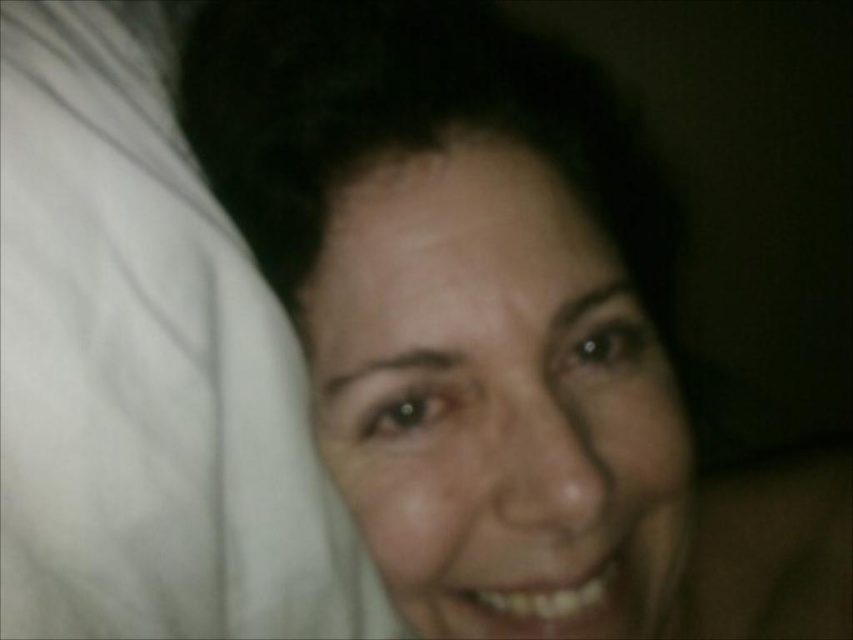
You are a photographer adjusting lighting for a portrait. You notice the white soft fabric at left and the smooth skin face at center in the frame. Which object is positioned higher in the image?

The white soft fabric at left is above the smooth skin face at center, so it is positioned higher in the image.

Looking at this image, you are a photographer trying to adjust the lighting for a portrait. You notice the smooth skin face at center and the white soft fabric at left in the frame. Which object is closer to the camera?

The white soft fabric at left is closer to the camera because the smooth skin face at center is behind it.

You are a photographer trying to adjust the lighting for a portrait. You notice the white soft fabric at left and the smooth skin face at center in the frame. Which object should you focus on to ensure proper exposure, considering their sizes?

The white soft fabric at left is larger in size than the smooth skin face at center, so focusing on the white soft fabric at left would help achieve proper exposure because larger objects have a greater impact on overall exposure levels.